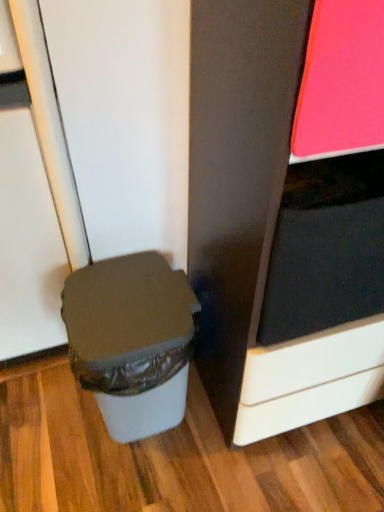
Question: Do you think white plastic waste bin at lower left is within matte black cabinet at right, or outside of it?

Choices:
 (A) inside
 (B) outside

Answer: (B)

Question: From the image's perspective, is white plastic waste bin at lower left positioned above or below matte black cabinet at right?

Choices:
 (A) above
 (B) below

Answer: (B)

Question: From a real-world perspective, is white plastic waste bin at lower left above or below matte black cabinet at right?

Choices:
 (A) above
 (B) below

Answer: (B)

Question: From the image's perspective, is matte black cabinet at right located above or below white plastic waste bin at lower left?

Choices:
 (A) below
 (B) above

Answer: (B)

Question: From a real-world perspective, is matte black cabinet at right positioned above or below white plastic waste bin at lower left?

Choices:
 (A) above
 (B) below

Answer: (A)

Question: Is matte black cabinet at right situated inside white plastic waste bin at lower left or outside?

Choices:
 (A) inside
 (B) outside

Answer: (B)

Question: Looking at their shapes, would you say matte black cabinet at right is wider or thinner than white plastic waste bin at lower left?

Choices:
 (A) thin
 (B) wide

Answer: (B)